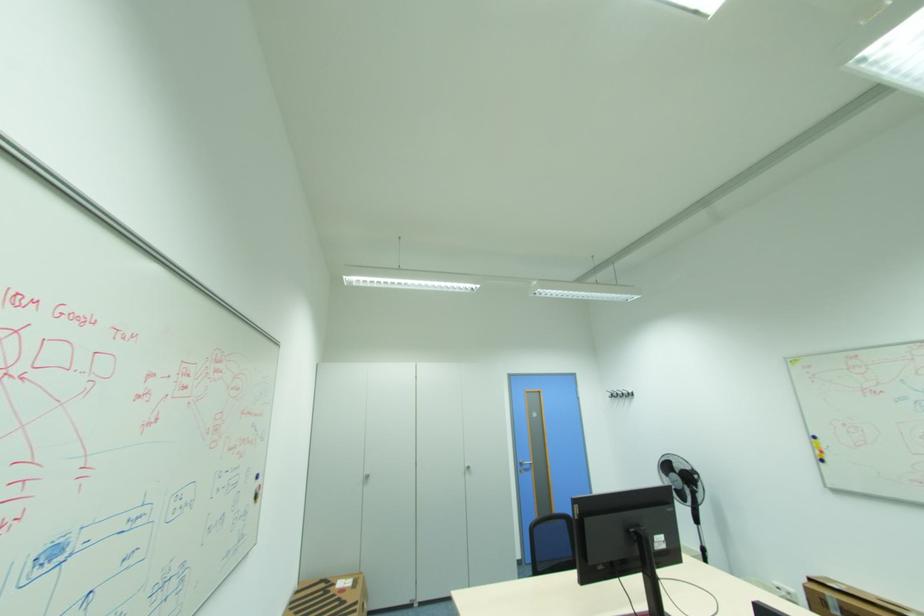
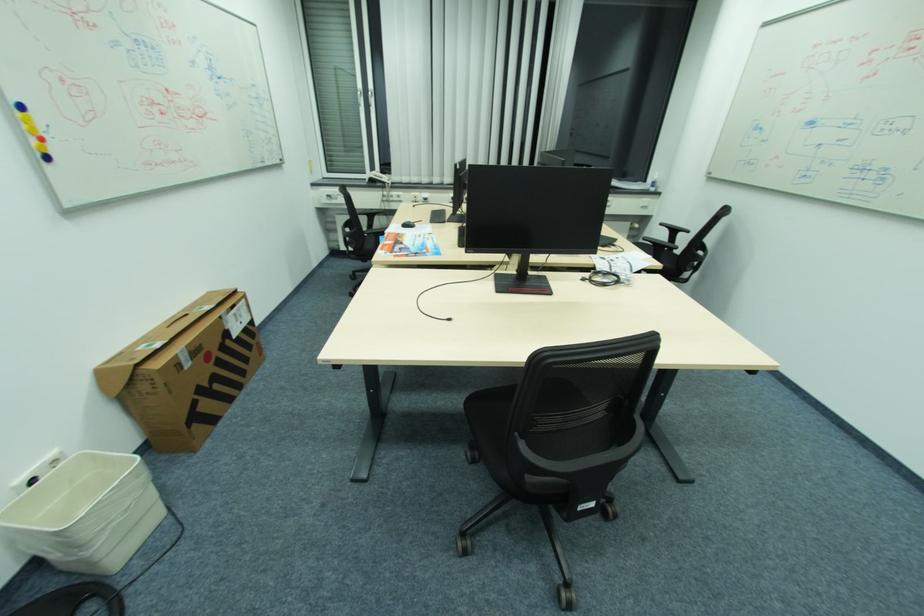
Find the pixel in the second image that matches pixel 827 453 in the first image.

(44, 140)